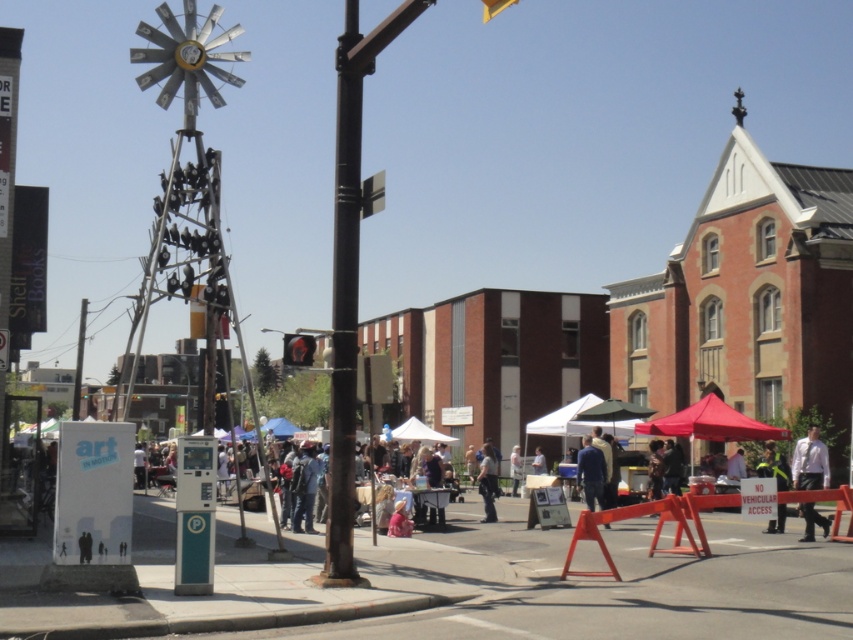
Between black metal pole at center and red fabric canopy at right, which one appears on the left side from the viewer's perspective?

black metal pole at center

Is point (323, 563) more distant than point (699, 424)?

That is False.

In order to click on black metal pole at center in this screenshot , I will do `click(344, 307)`.

Is white plastic sign at lower right to the right of white fabric canopy at center from the viewer's perspective?

Yes, white plastic sign at lower right is to the right of white fabric canopy at center.

Between white plastic sign at lower right and white fabric canopy at center, which one is positioned higher?

Positioned higher is white plastic sign at lower right.

Describe the element at coordinates (773, 467) in the screenshot. I see `white plastic sign at lower right` at that location.

The width and height of the screenshot is (853, 640). I want to click on white plastic sign at lower right, so click(x=773, y=467).

Does blue fabric jacket at center lie in front of white plastic sign at lower right?

That is False.

Does blue fabric jacket at center have a greater height compared to white plastic sign at lower right?

No.

Who is more distant from viewer, (x=590, y=483) or (x=769, y=518)?

The point (x=590, y=483) is more distant.

The width and height of the screenshot is (853, 640). Find the location of `blue fabric jacket at center`. blue fabric jacket at center is located at coordinates (590, 472).